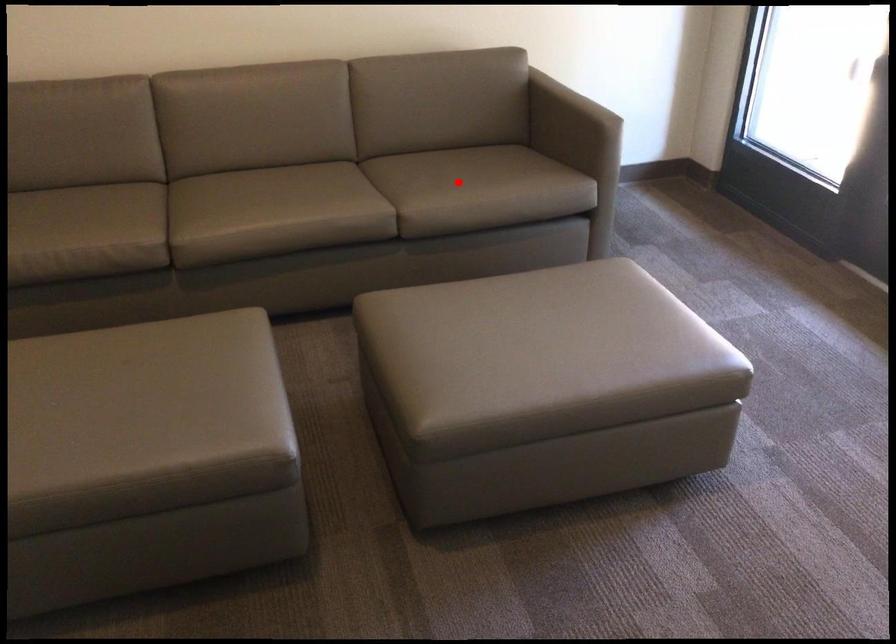
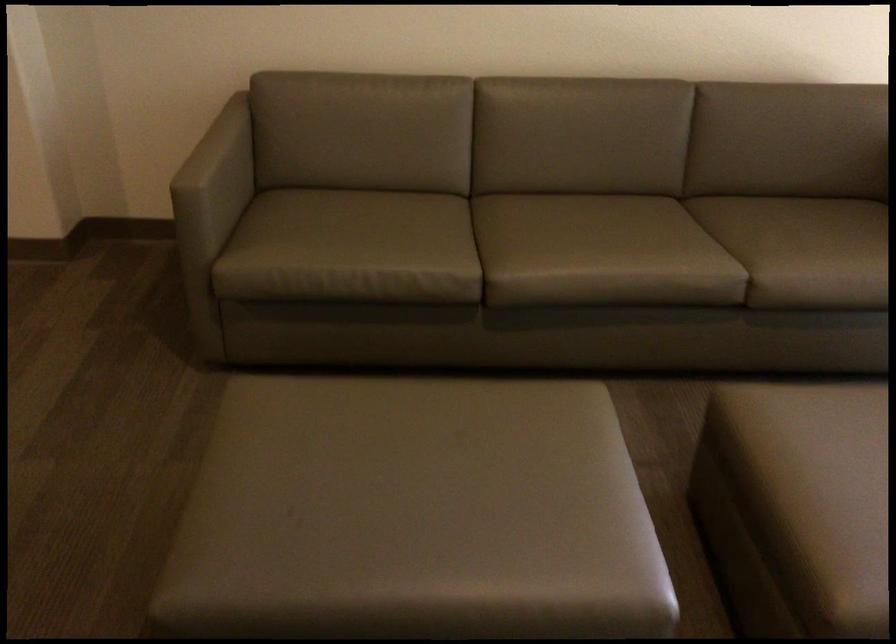
The point at the highlighted location is marked in the first image. Where is the corresponding point in the second image?

(819, 251)